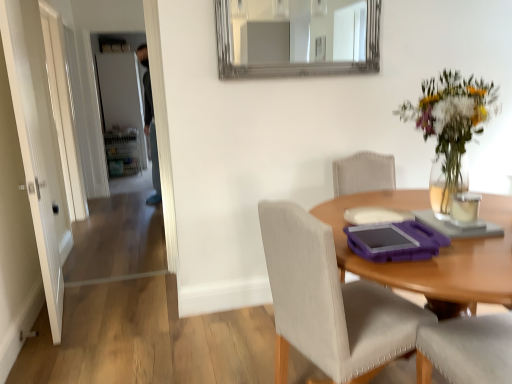
Measure the distance between point (104,116) and camera.

Point (104,116) is 6.68 meters away from camera.

What do you see at coordinates (122, 94) in the screenshot? The height and width of the screenshot is (384, 512). I see `white matte door at upper left, which ranks as the 1th door in back-to-front order` at bounding box center [122, 94].

Locate an element on the screen. silver-framed mirror at upper center is located at coordinates (298, 30).

The image size is (512, 384). What do you see at coordinates (466, 210) in the screenshot? I see `clear glass candle at upper right` at bounding box center [466, 210].

At what (x,y) coordinates should I click in order to perform the action: click on translucent glass vase at upper right. Please return your answer as a coordinate pair (x, y). Image resolution: width=512 pixels, height=384 pixels. Looking at the image, I should click on (451, 121).

Describe the element at coordinates (451, 121) in the screenshot. I see `translucent glass vase at upper right` at that location.

Where is `wooden table at center`? Image resolution: width=512 pixels, height=384 pixels. wooden table at center is located at coordinates (434, 257).

Measure the distance between white glossy door at left and white glossy door at left, the first door in the right-to-left sequence.

35.21 inches.

Considering the relative sizes of white glossy door at left and white glossy door at left, arranged as the second door when viewed from the back, in the image provided, is white glossy door at left smaller than white glossy door at left, arranged as the second door when viewed from the back,?

Yes, white glossy door at left is smaller than white glossy door at left, arranged as the second door when viewed from the back.

Would you consider white glossy door at left to be distant from white glossy door at left, the second door positioned from the left?

No, white glossy door at left is not far away from white glossy door at left, the second door positioned from the left.

Consider the image. Is white glossy door at left to the right of white glossy door at left, arranged as the second door when viewed from the back, from the viewer's perspective?

No, white glossy door at left is not to the right of white glossy door at left, arranged as the second door when viewed from the back.

From the image's perspective, which is below, translucent glass vase at upper right or white glossy door at left, arranged as the second door when viewed from the back?

white glossy door at left, arranged as the second door when viewed from the back, is shown below in the image.

How different are the orientations of translucent glass vase at upper right and white glossy door at left, arranged as the second door when viewed from the back, in degrees?

translucent glass vase at upper right and white glossy door at left, arranged as the second door when viewed from the back, are facing 105 degrees away from each other.

From a real-world perspective, between translucent glass vase at upper right and white glossy door at left, the first door in the right-to-left sequence, who is vertically higher?

translucent glass vase at upper right, from a real-world perspective.

From the picture: Does translucent glass vase at upper right appear on the right side of white glossy door at left, arranged as the second door when viewed from the back?

Yes, translucent glass vase at upper right is to the right of white glossy door at left, arranged as the second door when viewed from the back.

Locate an element on the screen. This screenshot has width=512, height=384. door on the left of the white glossy door at left, which is the first door in front-to-back order is located at coordinates tap(122, 94).

Between point (23, 33) and point (121, 56), which one is positioned in front?

The point (23, 33) is closer.

Is white glossy door at left, which is the first door in front-to-back order, oriented towards white matte door at upper left, the 1th door from the left?

No, white glossy door at left, which is the first door in front-to-back order, is not turned towards white matte door at upper left, the 1th door from the left.

Is white glossy door at left, the first door in the right-to-left sequence, far away from white matte door at upper left, the second door when ordered from right to left?

white glossy door at left, the first door in the right-to-left sequence, is far away from white matte door at upper left, the second door when ordered from right to left.

Is translucent glass vase at upper right at the back of silver-framed mirror at upper center?

silver-framed mirror at upper center is not turned away from translucent glass vase at upper right.

Which object is closer to the camera taking this photo, silver-framed mirror at upper center or translucent glass vase at upper right?

translucent glass vase at upper right.

Considering the sizes of white glossy door at left, arranged as the second door when viewed from the back, and clear glass candle at upper right in the image, is white glossy door at left, arranged as the second door when viewed from the back, taller or shorter than clear glass candle at upper right?

In the image, white glossy door at left, arranged as the second door when viewed from the back, appears to be taller than clear glass candle at upper right.

Is the position of white glossy door at left, the first door in the right-to-left sequence, more distant than that of clear glass candle at upper right?

Yes, white glossy door at left, the first door in the right-to-left sequence, is further from the camera.

The width and height of the screenshot is (512, 384). Find the location of `coffee cup on the right of white glossy door at left, which is the first door in front-to-back order`. coffee cup on the right of white glossy door at left, which is the first door in front-to-back order is located at coordinates (466, 210).

Considering the relative positions of white glossy door at left, arranged as the second door when viewed from the back, and clear glass candle at upper right in the image provided, is white glossy door at left, arranged as the second door when viewed from the back, to the left of clear glass candle at upper right from the viewer's perspective?

Yes.

Can you confirm if white matte door at upper left, the second door when ordered from right to left, is wider than clear glass candle at upper right?

No.

Which is less distant, (138, 96) or (472, 224)?

The point (472, 224) is more forward.

Is white matte door at upper left, the 2th door from the front, beside clear glass candle at upper right?

They are not placed beside each other.

How far apart are wooden table at center and white glossy door at left, arranged as the second door when viewed from the back?

wooden table at center is 1.83 meters from white glossy door at left, arranged as the second door when viewed from the back.

From a real-world perspective, which is physically below, wooden table at center or white glossy door at left, the first door in the right-to-left sequence?

wooden table at center is physically lower.

How many degrees apart are the facing directions of wooden table at center and white glossy door at left, which is the first door in front-to-back order?

wooden table at center and white glossy door at left, which is the first door in front-to-back order, are facing 75.9 degrees away from each other.

From the image's perspective, which is above, wooden table at center or white glossy door at left, which is the first door in front-to-back order?

white glossy door at left, which is the first door in front-to-back order, from the image's perspective.

From a real-world perspective, which door is the 2nd one underneath the white glossy door at left? Please provide its 2D coordinates.

[(37, 145)]

Where is `the 1st door to the left when counting from the translucent glass vase at upper right`? Image resolution: width=512 pixels, height=384 pixels. the 1st door to the left when counting from the translucent glass vase at upper right is located at coordinates (37, 145).

Considering their positions, is white glossy door at left positioned closer to white glossy door at left, the first door in the right-to-left sequence, than wooden table at center?

white glossy door at left.

Estimate the real-world distances between objects in this image. Which object is further from silver-framed mirror at upper center, clear glass candle at upper right or wooden table at center?

clear glass candle at upper right is positioned further to the anchor silver-framed mirror at upper center.

Looking at this image, looking at the image, which one is located closer to white matte door at upper left, the 2th door from the front, clear glass candle at upper right or white glossy door at left?

Among the two, white glossy door at left is located nearer to white matte door at upper left, the 2th door from the front.

Looking at the image, which one is located closer to translucent glass vase at upper right, wooden table at center or silver-framed mirror at upper center?

wooden table at center is closer to translucent glass vase at upper right.

From the image, which object appears to be farther from white matte door at upper left, the second door when ordered from right to left, white glossy door at left or matte purple tray at center?

Based on the image, matte purple tray at center appears to be further to white matte door at upper left, the second door when ordered from right to left.

When comparing their distances from white matte door at upper left, the 1th door from the left, does white glossy door at left or silver-framed mirror at upper center seem closer?

silver-framed mirror at upper center is closer to white matte door at upper left, the 1th door from the left.

From the picture: Estimate the real-world distances between objects in this image. Which object is closer to silver-framed mirror at upper center, wooden table at center or clear glass candle at upper right?

wooden table at center lies closer to silver-framed mirror at upper center than the other object.

Based on the photo, considering their positions, is translucent glass vase at upper right positioned closer to white glossy door at left than clear glass candle at upper right?

translucent glass vase at upper right is closer to white glossy door at left.

Find the location of a particular element. This screenshot has height=384, width=512. door located between wooden table at center and white matte door at upper left, which ranks as the 1th door in back-to-front order, in the depth direction is located at coordinates (37, 145).

Locate an element on the screen. This screenshot has height=384, width=512. mirror situated between white glossy door at left, the first door in the right-to-left sequence, and matte purple tray at center from left to right is located at coordinates point(298,30).

Find the location of a particular element. This screenshot has width=512, height=384. coffee cup located between matte purple tray at center and white matte door at upper left, the second door when ordered from right to left, in the depth direction is located at coordinates (466, 210).

Image resolution: width=512 pixels, height=384 pixels. Identify the location of chair between wooden table at center and white matte door at upper left, the 2th door from the front, in the front-back direction. (329, 302).